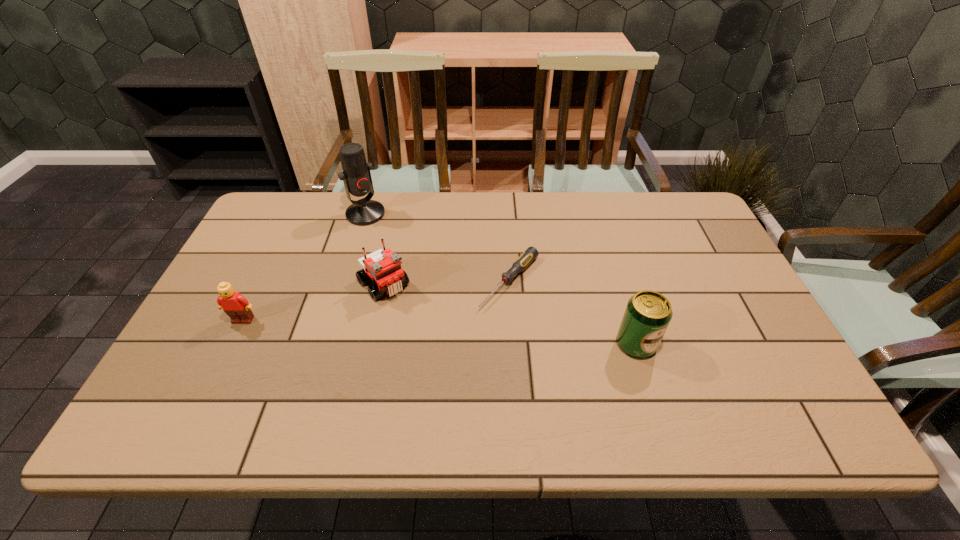
Image resolution: width=960 pixels, height=540 pixels. I want to click on the fourth farthest object, so pos(236,306).

Where is `the nearer Lego`? The width and height of the screenshot is (960, 540). the nearer Lego is located at coordinates (236, 306).

In order to click on beer can in this screenshot , I will do `click(648, 313)`.

This screenshot has width=960, height=540. I want to click on the rightmost object, so click(x=648, y=313).

Image resolution: width=960 pixels, height=540 pixels. What are the coordinates of `the farther Lego` in the screenshot? It's located at (384, 266).

Identify the location of the fourth object from left to right. (529, 255).

Identify the location of screwdriver. The width and height of the screenshot is (960, 540). (529, 255).

I want to click on the tallest object, so click(x=356, y=175).

Identify the location of microphone. The height and width of the screenshot is (540, 960). (356, 175).

Identify the location of vacant area situated on the face of the nearer Lego. (231, 345).